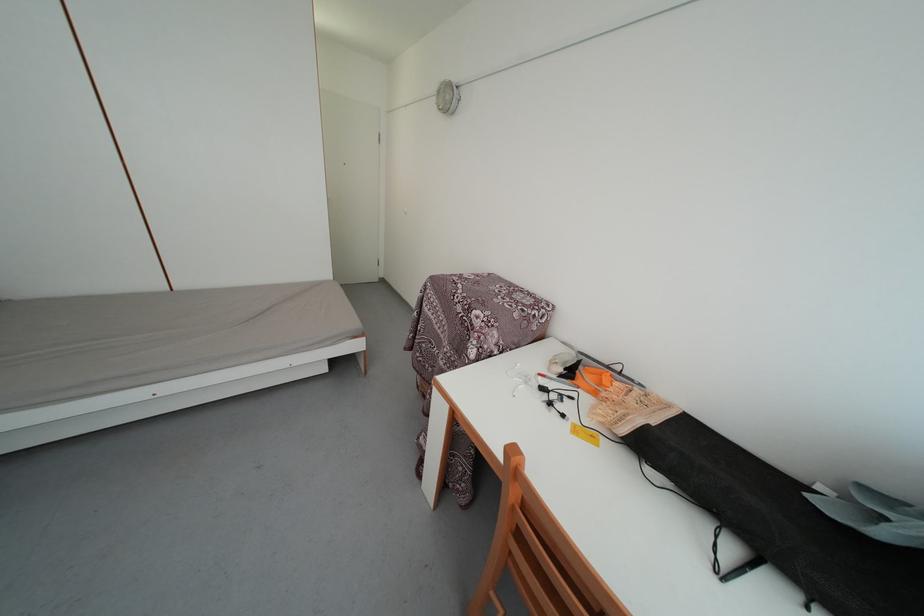
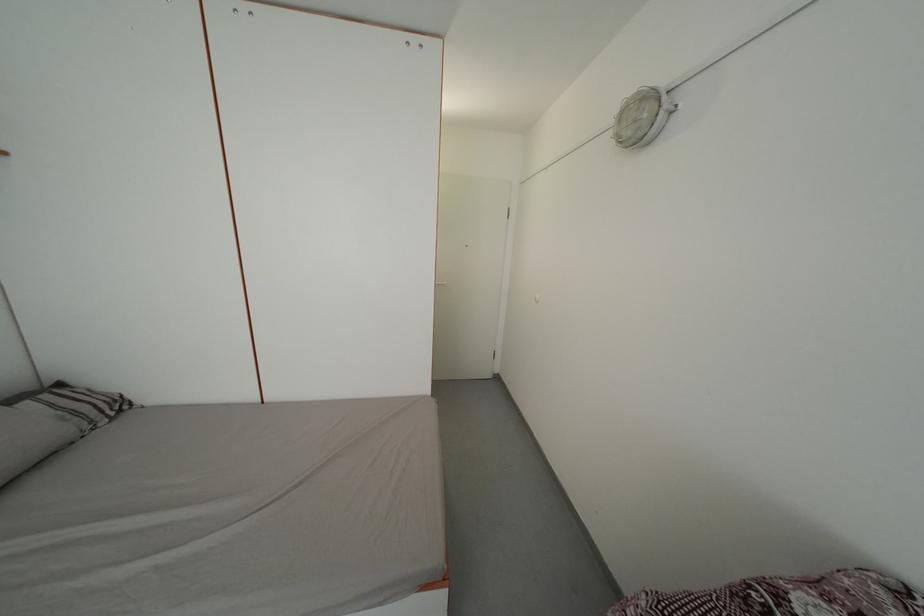
Question: How did the camera likely rotate?

Choices:
 (A) Left
 (B) Right
 (C) Up
 (D) Down

Answer: (A)